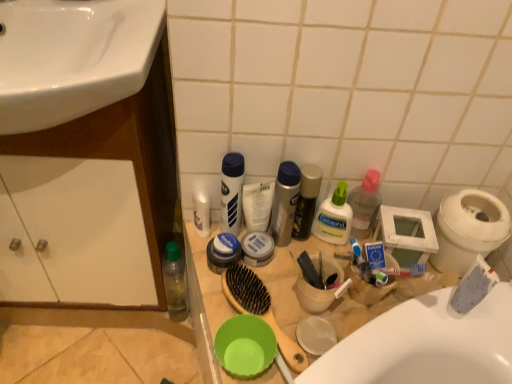
Question: Considering the positions of wooden counter top at center and white plastic bidet at right in the image, is wooden counter top at center taller or shorter than white plastic bidet at right?

Choices:
 (A) short
 (B) tall

Answer: (B)

Question: In the image, is wooden counter top at center on the left side or the right side of white plastic bidet at right?

Choices:
 (A) right
 (B) left

Answer: (B)

Question: Which of these objects is positioned closest to the silver metallic can at center, the fourth toiletry in the right-to-left sequence?

Choices:
 (A) white matte lotion at center, the 1th toiletry from the left
 (B) blue matte toothpaste at center, the 2th toothpaste from the front
 (C) white plastic canister at center, the sixth toiletry in the right-to-left sequence
 (D) shiny black bottle at center, the third toiletry when ordered from right to left
 (E) brown wooden brush at center

Answer: (D)

Question: Considering the real-world distances, which object is farthest from the matte white cream container at center, which is the 5th toiletry in right-to-left order?

Choices:
 (A) wooden counter top at center
 (B) white matte lotion at center, the 1th toiletry from the left
 (C) white pump bottle at center, which is the seventh toiletry from left to right
 (D) brown wooden brush at center
 (E) blue rubber balm at center, marked as the 2th toiletry in a left-to-right arrangement

Answer: (A)